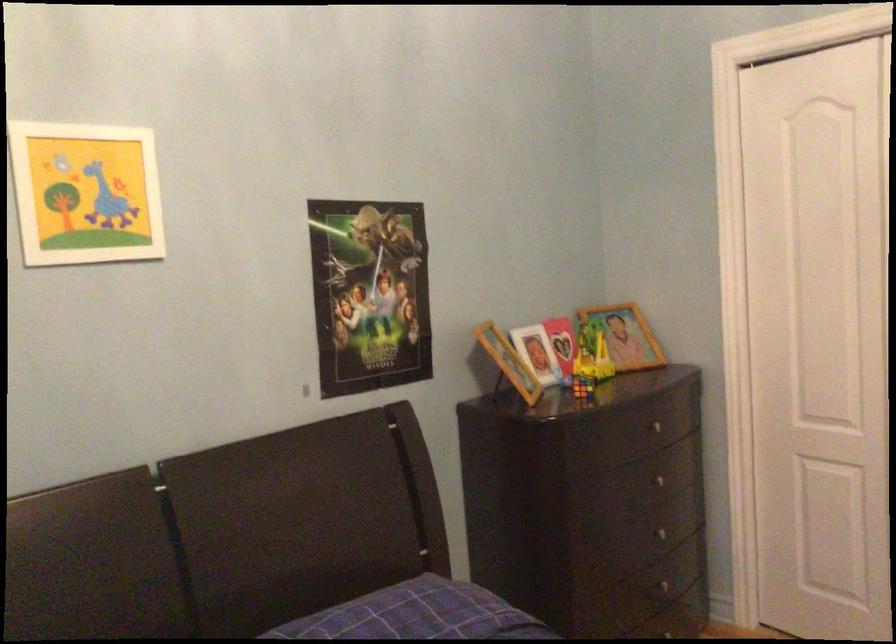
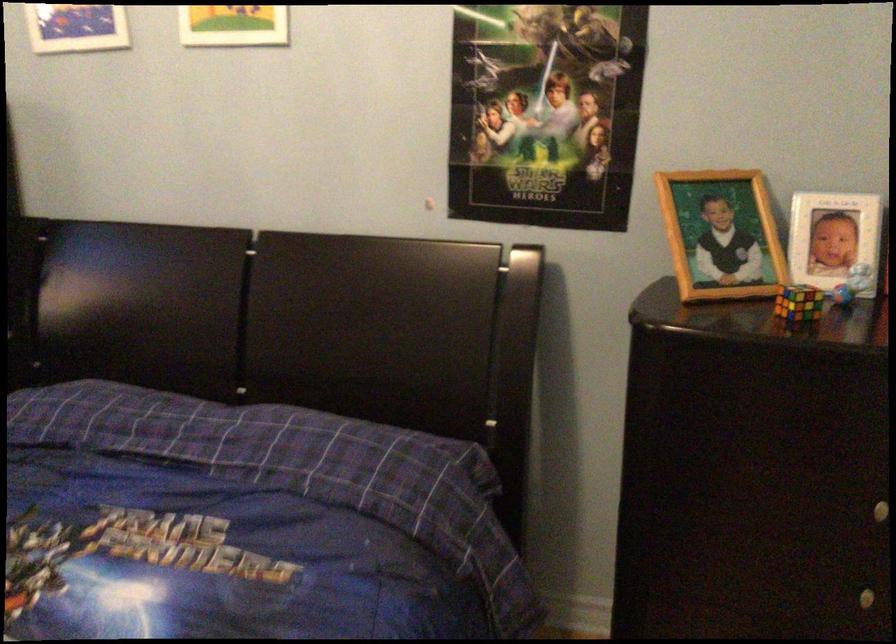
The point at (562, 372) is marked in the first image. Where is the corresponding point in the second image?

(851, 283)